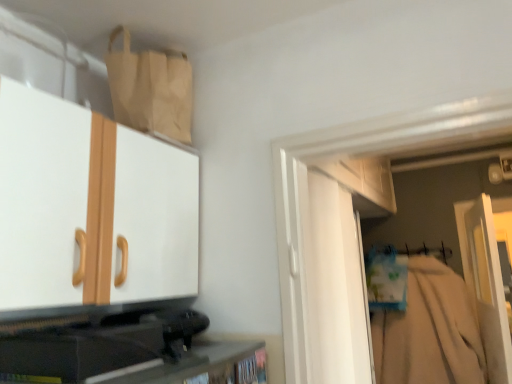
I want to click on vacant region above matte beige paper bag at upper left (from a real-world perspective), so click(x=157, y=43).